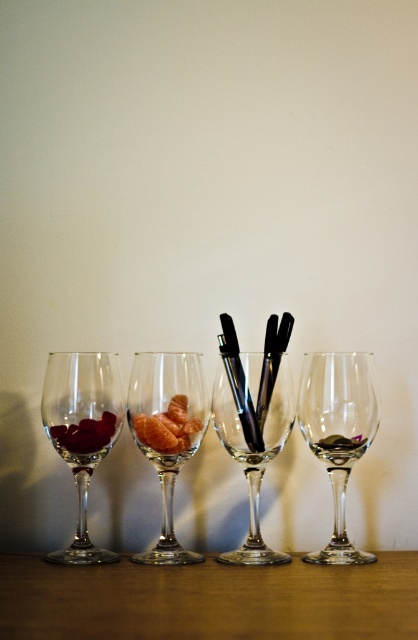
Which is behind, point (150, 454) or point (211, 416)?

The point (211, 416) is more distant.

What do you see at coordinates (168, 432) in the screenshot? I see `translucent glass at center` at bounding box center [168, 432].

Locate an element on the screen. The image size is (418, 640). translucent glass at center is located at coordinates click(168, 432).

Can you confirm if wooden table at center is bigger than shiny red grapes at left?

Correct, wooden table at center is larger in size than shiny red grapes at left.

Identify the location of wooden table at center. Image resolution: width=418 pixels, height=640 pixels. (209, 600).

In order to click on wooden table at center in this screenshot , I will do `click(209, 600)`.

Which is behind, point (234, 326) or point (338, 440)?

The point (234, 326) is more distant.

Who is positioned more to the right, black glossy fountain pen at center or transparent glass at center?

transparent glass at center

Does point (229, 381) come in front of point (359, 438)?

Yes, it is.

Locate an element on the screen. The width and height of the screenshot is (418, 640). black glossy fountain pen at center is located at coordinates (239, 384).